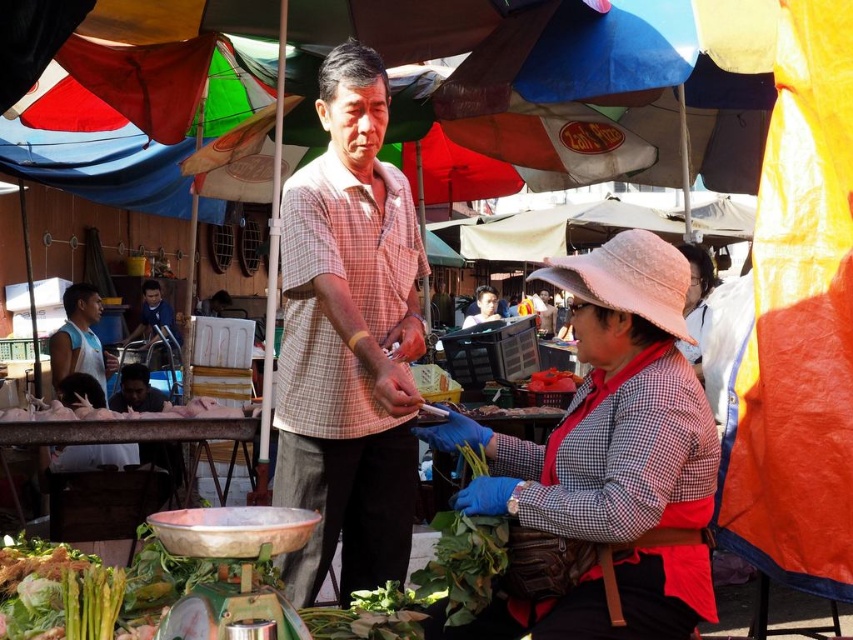
Question: Does pink fabric hat at upper center appear on the right side of smooth brown shirt at center?

Choices:
 (A) no
 (B) yes

Answer: (A)

Question: Which object is positioned farthest from the light blue sleeveless shirt at left?

Choices:
 (A) blue shirt at center
 (B) pink fabric hat at upper center
 (C) smooth brown shirt at center

Answer: (C)

Question: Which object is the closest to the blue shirt at center?

Choices:
 (A) light blue sleeveless shirt at left
 (B) pink fabric hat at upper center
 (C) plaid shirt at center
 (D) smooth brown shirt at center

Answer: (A)

Question: Is plaid shirt at center positioned at the back of blue shirt at center?

Choices:
 (A) yes
 (B) no

Answer: (B)

Question: Which object is positioned farthest from the plaid shirt at center?

Choices:
 (A) smooth brown shirt at center
 (B) blue shirt at center

Answer: (A)

Question: Can you confirm if pink fabric hat at upper center is positioned to the right of light blue sleeveless shirt at left?

Choices:
 (A) no
 (B) yes

Answer: (B)